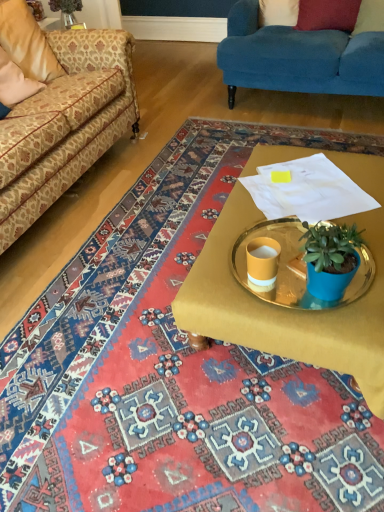
Question: Considering the relative sizes of matte yellow cup at center and patterned fabric couch at left, which ranks as the second studio couch in right-to-left order, in the image provided, is matte yellow cup at center wider than patterned fabric couch at left, which ranks as the second studio couch in right-to-left order,?

Choices:
 (A) no
 (B) yes

Answer: (A)

Question: Does matte yellow cup at center appear on the left side of patterned fabric couch at left, marked as the first studio couch in a left-to-right arrangement?

Choices:
 (A) yes
 (B) no

Answer: (B)

Question: Is matte yellow cup at center to the right of patterned fabric couch at left, marked as the first studio couch in a left-to-right arrangement, from the viewer's perspective?

Choices:
 (A) yes
 (B) no

Answer: (A)

Question: Is matte yellow cup at center positioned beyond the bounds of patterned fabric couch at left, marked as the first studio couch in a left-to-right arrangement?

Choices:
 (A) yes
 (B) no

Answer: (A)

Question: Is the surface of matte yellow cup at center in direct contact with patterned fabric couch at left, which ranks as the second studio couch in right-to-left order?

Choices:
 (A) yes
 (B) no

Answer: (B)

Question: Considering the relative positions of matte yellow cup at center and patterned fabric couch at left, marked as the first studio couch in a left-to-right arrangement, in the image provided, is matte yellow cup at center in front of patterned fabric couch at left, marked as the first studio couch in a left-to-right arrangement,?

Choices:
 (A) no
 (B) yes

Answer: (A)

Question: Is gold metallic tray at center oriented towards velvet red pillow at upper right, which is counted as the first pillow, starting from the right?

Choices:
 (A) yes
 (B) no

Answer: (B)

Question: From a real-world perspective, is gold metallic tray at center below velvet red pillow at upper right, which is counted as the first pillow, starting from the right?

Choices:
 (A) yes
 (B) no

Answer: (A)

Question: Can you confirm if gold metallic tray at center is positioned to the right of velvet red pillow at upper right, which is counted as the first pillow, starting from the right?

Choices:
 (A) yes
 (B) no

Answer: (B)

Question: Is gold metallic tray at center bigger than velvet red pillow at upper right, positioned as the 4th pillow in left-to-right order?

Choices:
 (A) no
 (B) yes

Answer: (B)

Question: Is gold metallic tray at center touching velvet red pillow at upper right, positioned as the 4th pillow in left-to-right order?

Choices:
 (A) yes
 (B) no

Answer: (B)

Question: Is gold metallic tray at center smaller than velvet red pillow at upper right, positioned as the 4th pillow in left-to-right order?

Choices:
 (A) no
 (B) yes

Answer: (A)

Question: Is the depth of beige fabric pillow at upper left, which is counted as the fourth pillow, starting from the right, less than that of velvet blue couch at upper right, which appears as the 2th studio couch when viewed from the left?

Choices:
 (A) yes
 (B) no

Answer: (A)